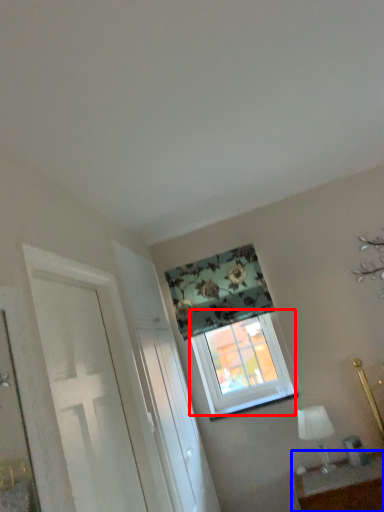
Question: Which object is closer to the camera taking this photo, window (highlighted by a red box) or table (highlighted by a blue box)?

Choices:
 (A) window
 (B) table

Answer: (B)